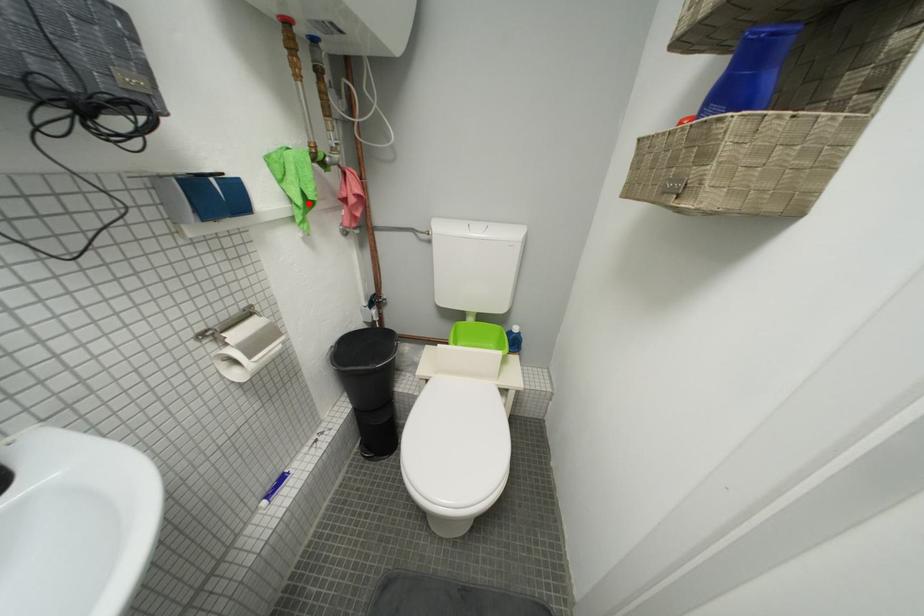
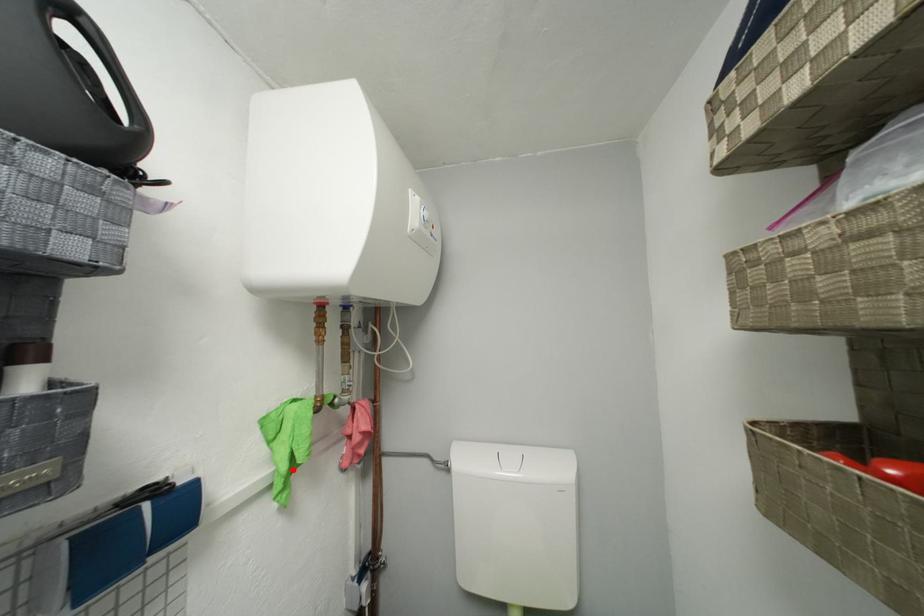
I am providing you with two images of the same scene from different viewpoints. A red point is marked on the first image and another point is marked on the second image. Does the point marked in image1 correspond to the same location as the one in image2?

Yes